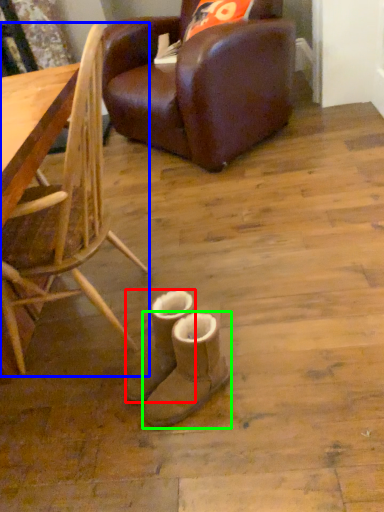
Question: Estimate the real-world distances between objects in this image. Which object is closer to footwear (highlighted by a red box), chair (highlighted by a blue box) or footwear (highlighted by a green box)?

Choices:
 (A) chair
 (B) footwear

Answer: (B)